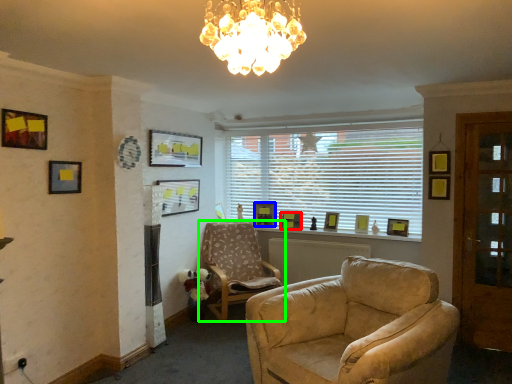
Question: Which is farther away from picture frame (highlighted by a red box)? picture frame (highlighted by a blue box) or chair (highlighted by a green box)?

Choices:
 (A) picture frame
 (B) chair

Answer: (B)